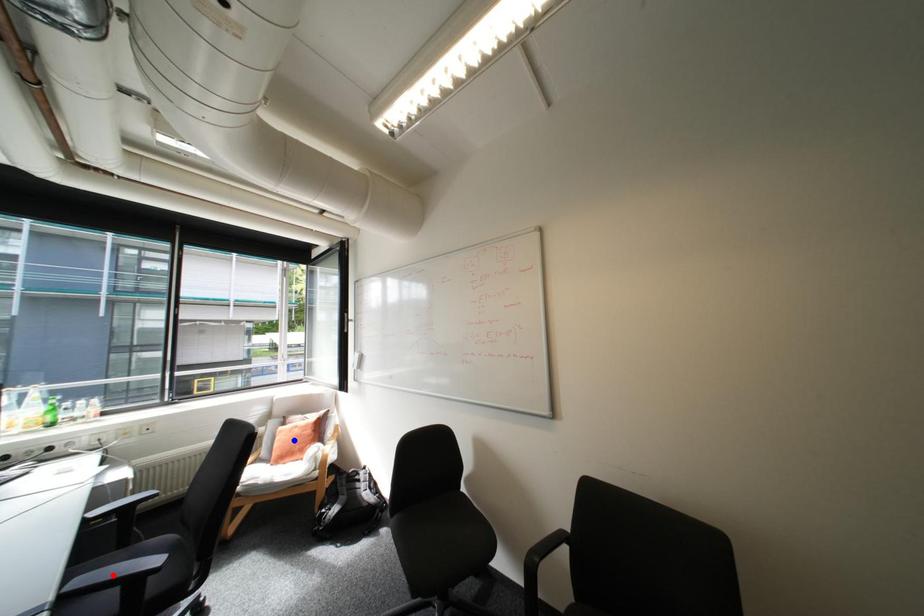
Question: In the image, two points are highlighted. Which point is nearer to the camera? Reply with the corresponding letter.

Choices:
 (A) blue point
 (B) red point

Answer: (B)